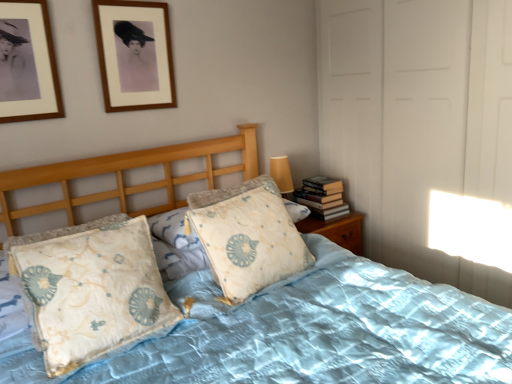
Question: Does light blue fabric pillow at center, the second pillow from the left, have a greater width compared to light blue quilted bed at center?

Choices:
 (A) no
 (B) yes

Answer: (A)

Question: Does light blue fabric pillow at center, the second pillow from the left, contain light blue quilted bed at center?

Choices:
 (A) yes
 (B) no

Answer: (B)

Question: Is light blue fabric pillow at center, the second pillow from the left, taller than light blue quilted bed at center?

Choices:
 (A) yes
 (B) no

Answer: (B)

Question: Is light blue fabric pillow at center, the second pillow from the left, oriented away from light blue quilted bed at center?

Choices:
 (A) no
 (B) yes

Answer: (B)

Question: Would you say light blue fabric pillow at center, the 1th pillow from the right, is outside light blue quilted bed at center?

Choices:
 (A) yes
 (B) no

Answer: (B)

Question: Does light blue fabric pillow at center, the 1th pillow from the right, lie in front of light blue quilted bed at center?

Choices:
 (A) no
 (B) yes

Answer: (A)

Question: Can we say light blue fabric pillow at center, the second pillow from the left, lies outside wooden picture frame at upper left, which is the second picture frame in back-to-front order?

Choices:
 (A) no
 (B) yes

Answer: (B)

Question: Considering the relative sizes of light blue fabric pillow at center, the 1th pillow from the right, and wooden picture frame at upper left, arranged as the 1th picture frame when viewed from the left, in the image provided, is light blue fabric pillow at center, the 1th pillow from the right, shorter than wooden picture frame at upper left, arranged as the 1th picture frame when viewed from the left,?

Choices:
 (A) no
 (B) yes

Answer: (A)

Question: Is light blue fabric pillow at center, the second pillow from the left, bigger than wooden picture frame at upper left, arranged as the 1th picture frame when viewed from the left?

Choices:
 (A) no
 (B) yes

Answer: (B)

Question: Considering the relative sizes of light blue fabric pillow at center, the second pillow from the left, and wooden picture frame at upper left, arranged as the 1th picture frame when viewed from the left, in the image provided, is light blue fabric pillow at center, the second pillow from the left, wider than wooden picture frame at upper left, arranged as the 1th picture frame when viewed from the left,?

Choices:
 (A) yes
 (B) no

Answer: (A)

Question: From a real-world perspective, is light blue fabric pillow at center, the 1th pillow from the right, beneath wooden picture frame at upper left, acting as the first picture frame starting from the front?

Choices:
 (A) yes
 (B) no

Answer: (A)

Question: Is light blue fabric pillow at center, the second pillow from the left, positioned behind wooden picture frame at upper left, arranged as the 1th picture frame when viewed from the left?

Choices:
 (A) yes
 (B) no

Answer: (A)

Question: Is light blue fabric pillow at center, the 1th pillow from the right, bigger than light blue fabric pillow at center, which is the 2th pillow from right to left?

Choices:
 (A) no
 (B) yes

Answer: (A)